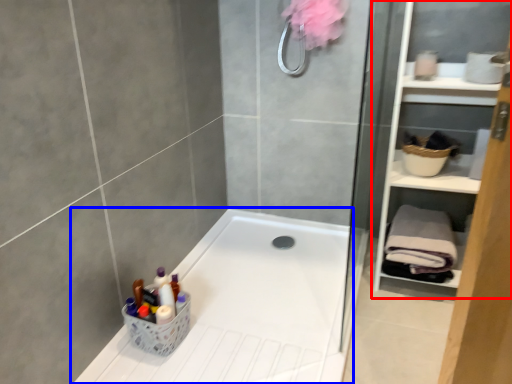
Question: Which of the following is the farthest to the observer, cabinet (highlighted by a red box) or bathtub (highlighted by a blue box)?

Choices:
 (A) cabinet
 (B) bathtub

Answer: (A)